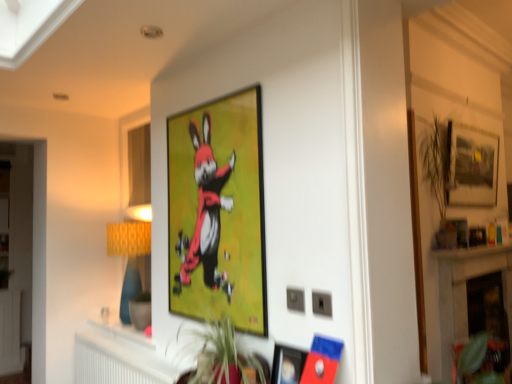
Question: Are white plastic radiator at lower center and matte black picture frame at upper center, placed as the 2th picture frame when sorted from front to back, beside each other?

Choices:
 (A) no
 (B) yes

Answer: (A)

Question: Is there a large distance between white plastic radiator at lower center and matte black picture frame at upper center, placed as the 1th picture frame when sorted from left to right?

Choices:
 (A) yes
 (B) no

Answer: (B)

Question: Does white plastic radiator at lower center have a lesser width compared to matte black picture frame at upper center, placed as the 2th picture frame when sorted from front to back?

Choices:
 (A) no
 (B) yes

Answer: (A)

Question: Does white plastic radiator at lower center have a smaller size compared to matte black picture frame at upper center, acting as the 3th picture frame starting from the right?

Choices:
 (A) no
 (B) yes

Answer: (A)

Question: Can you confirm if white plastic radiator at lower center is shorter than matte black picture frame at upper center, placed as the 2th picture frame when sorted from front to back?

Choices:
 (A) no
 (B) yes

Answer: (B)

Question: Is white plastic radiator at lower center taller than matte black picture frame at upper center, placed as the 1th picture frame when sorted from left to right?

Choices:
 (A) yes
 (B) no

Answer: (B)

Question: Considering the relative sizes of green leafy plant at lower right, the 2th plant viewed from the top, and matte black picture frame at upper right, the first picture frame in the back-to-front sequence, in the image provided, is green leafy plant at lower right, the 2th plant viewed from the top, thinner than matte black picture frame at upper right, the first picture frame in the back-to-front sequence,?

Choices:
 (A) no
 (B) yes

Answer: (A)

Question: Is green leafy plant at lower right, marked as the first plant in a bottom-to-top arrangement, further to camera compared to matte black picture frame at upper right, acting as the third picture frame starting from the left?

Choices:
 (A) no
 (B) yes

Answer: (A)

Question: Can you confirm if green leafy plant at lower right, marked as the 2th plant in a left-to-right arrangement, is bigger than matte black picture frame at upper right, acting as the third picture frame starting from the left?

Choices:
 (A) no
 (B) yes

Answer: (A)

Question: Is green leafy plant at lower right, marked as the first plant in a bottom-to-top arrangement, at the left side of matte black picture frame at upper right, the first picture frame in the back-to-front sequence?

Choices:
 (A) yes
 (B) no

Answer: (A)

Question: From a real-world perspective, is green leafy plant at lower right, placed as the 2th plant when sorted from front to back, physically above matte black picture frame at upper right, the third picture frame viewed from the front?

Choices:
 (A) yes
 (B) no

Answer: (B)

Question: Would you consider green leafy plant at lower right, arranged as the 1th plant when viewed from the right, to be distant from matte black picture frame at upper right, the third picture frame viewed from the front?

Choices:
 (A) yes
 (B) no

Answer: (A)

Question: Is white marble fireplace at lower right completely or partially outside of white plastic radiator at lower center?

Choices:
 (A) yes
 (B) no

Answer: (A)